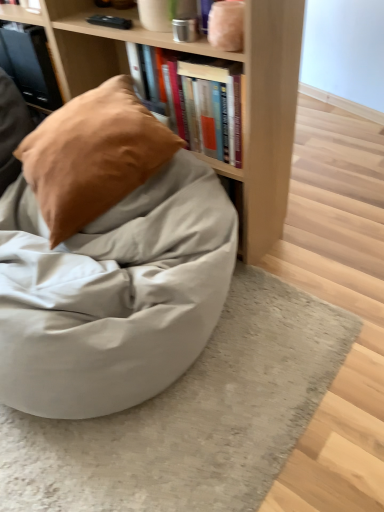
Question: Is suede-like tan pillow at upper left aimed at matte gray bean bag at center?

Choices:
 (A) no
 (B) yes

Answer: (B)

Question: Does suede-like tan pillow at upper left come in front of matte gray bean bag at center?

Choices:
 (A) yes
 (B) no

Answer: (B)

Question: Is matte gray bean bag at center completely or partially inside suede-like tan pillow at upper left?

Choices:
 (A) yes
 (B) no

Answer: (B)

Question: Considering the relative positions of suede-like tan pillow at upper left and matte gray bean bag at center in the image provided, is suede-like tan pillow at upper left behind matte gray bean bag at center?

Choices:
 (A) yes
 (B) no

Answer: (A)

Question: From a real-world perspective, is suede-like tan pillow at upper left physically below matte gray bean bag at center?

Choices:
 (A) yes
 (B) no

Answer: (B)

Question: Can you confirm if suede-like tan pillow at upper left is thinner than matte gray bean bag at center?

Choices:
 (A) no
 (B) yes

Answer: (B)

Question: Is suede-like tan pillow at upper left not near hardcover books at upper center, which is the first book in bottom-to-top order?

Choices:
 (A) no
 (B) yes

Answer: (A)

Question: Would you say hardcover books at upper center, the 1th book viewed from the right, is part of suede-like tan pillow at upper left's contents?

Choices:
 (A) no
 (B) yes

Answer: (A)

Question: Is suede-like tan pillow at upper left thinner than hardcover books at upper center, arranged as the 2th book when viewed from the top?

Choices:
 (A) yes
 (B) no

Answer: (B)

Question: From a real-world perspective, is suede-like tan pillow at upper left beneath hardcover books at upper center, arranged as the 2th book when viewed from the back?

Choices:
 (A) no
 (B) yes

Answer: (B)

Question: Is suede-like tan pillow at upper left positioned beyond the bounds of hardcover books at upper center, the 1th book viewed from the right?

Choices:
 (A) yes
 (B) no

Answer: (A)

Question: From the image's perspective, is suede-like tan pillow at upper left over hardcover books at upper center, arranged as the 2th book when viewed from the top?

Choices:
 (A) no
 (B) yes

Answer: (A)

Question: Can we say matte black book at upper left, which ranks as the second book in bottom-to-top order, lies outside matte gray bean bag at center?

Choices:
 (A) no
 (B) yes

Answer: (B)